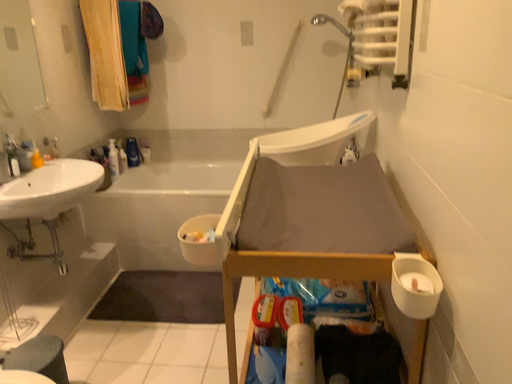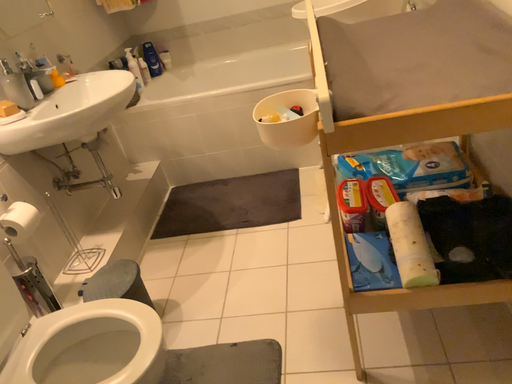
Question: Which way did the camera rotate in the video?

Choices:
 (A) rotated upward
 (B) rotated downward

Answer: (B)